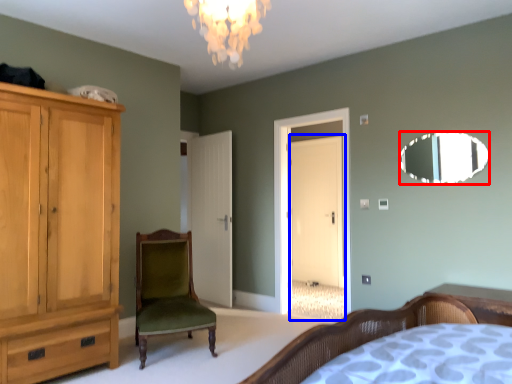
Question: Which point is further to the camera, mirror (highlighted by a red box) or glass door (highlighted by a blue box)?

Choices:
 (A) mirror
 (B) glass door

Answer: (B)